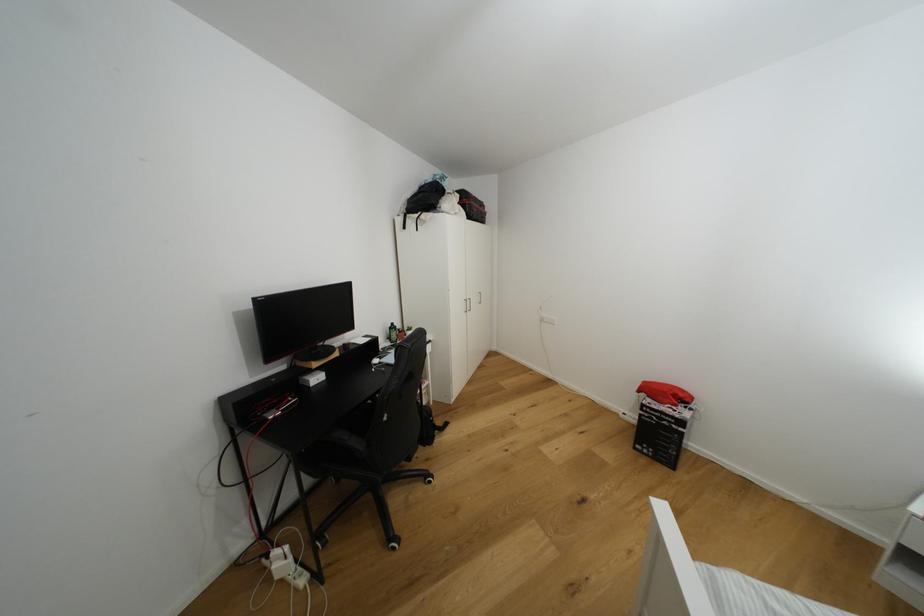
Describe the element at coordinates (428, 426) in the screenshot. I see `the black backpack` at that location.